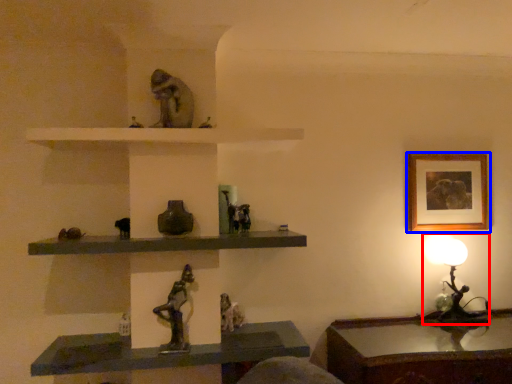
Question: Among these objects, which one is nearest to the camera, table lamp (highlighted by a red box) or picture frame (highlighted by a blue box)?

Choices:
 (A) table lamp
 (B) picture frame

Answer: (A)